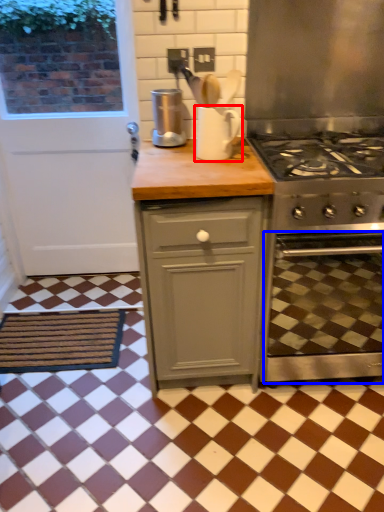
Question: Which of the following is the closest to the observer, appliance (highlighted by a red box) or oven (highlighted by a blue box)?

Choices:
 (A) appliance
 (B) oven

Answer: (B)